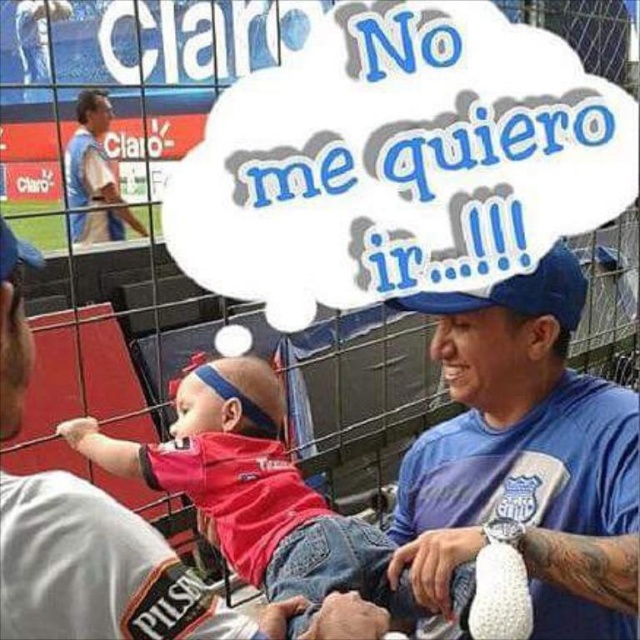
Question: Among these points, which one is nearest to the camera?

Choices:
 (A) click(273, 588)
 (B) click(573, 305)
 (C) click(104, 170)

Answer: (B)

Question: Based on their relative distances, which object is farther from the matte red shirt at center?

Choices:
 (A) matte blue shirt at upper left
 (B) blue fabric shirt at center

Answer: (A)

Question: Is blue fabric shirt at center to the right of matte red shirt at center from the viewer's perspective?

Choices:
 (A) yes
 (B) no

Answer: (A)

Question: Is matte red shirt at center to the right of matte blue shirt at upper left from the viewer's perspective?

Choices:
 (A) yes
 (B) no

Answer: (A)

Question: Which object appears closest to the camera in this image?

Choices:
 (A) matte blue shirt at upper left
 (B) matte red shirt at center

Answer: (B)

Question: Does blue fabric shirt at center lie behind matte blue shirt at upper left?

Choices:
 (A) yes
 (B) no

Answer: (B)